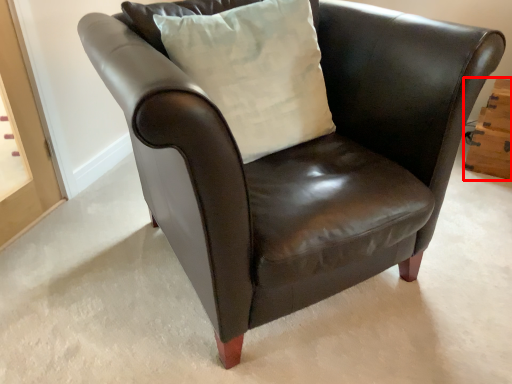
Question: Considering the relative positions of drawer (annotated by the red box) and pillow in the image provided, where is drawer (annotated by the red box) located with respect to the staircase?

Choices:
 (A) right
 (B) left

Answer: (A)